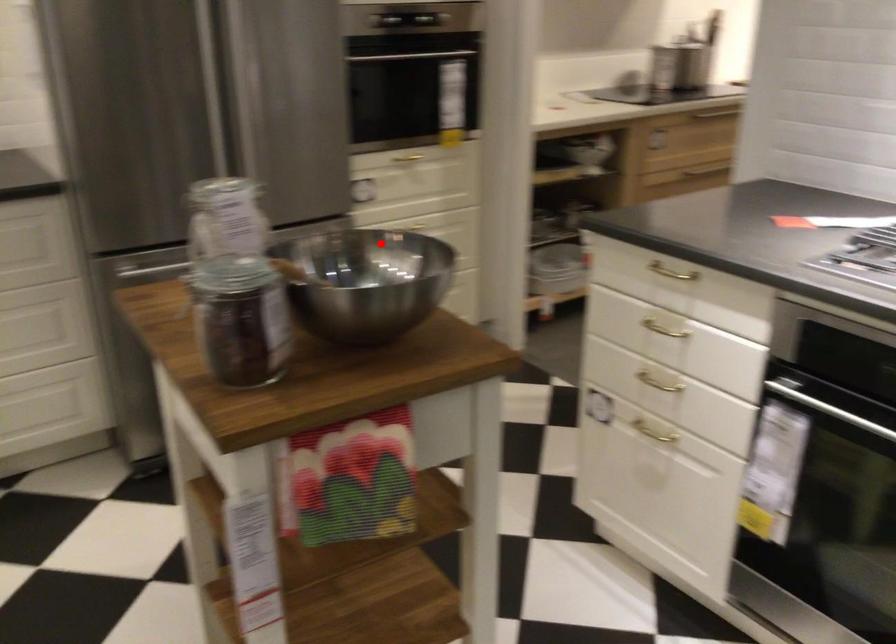
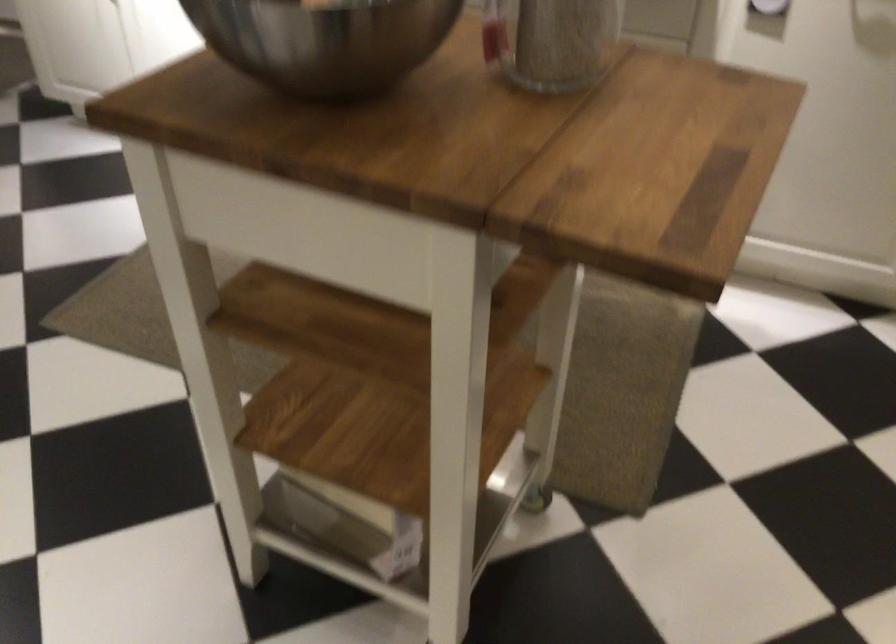
In the second image, find the point that corresponds to the highlighted location in the first image.

(323, 41)